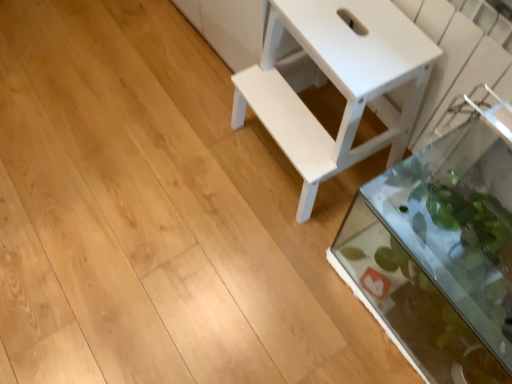
This screenshot has height=384, width=512. Find the location of `free location to the left of white matte table at center`. free location to the left of white matte table at center is located at coordinates (198, 155).